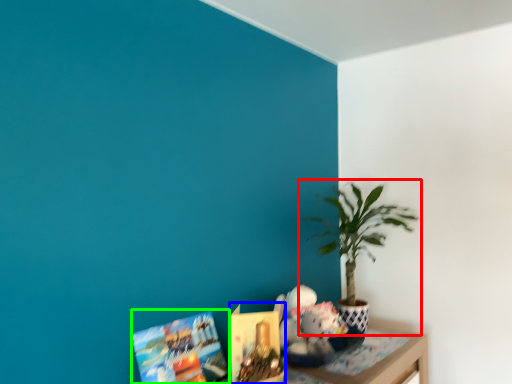
Question: Which is nearer to the houseplant (highlighted by a red box)? book (highlighted by a blue box) or book (highlighted by a green box).

Choices:
 (A) book
 (B) book

Answer: (A)